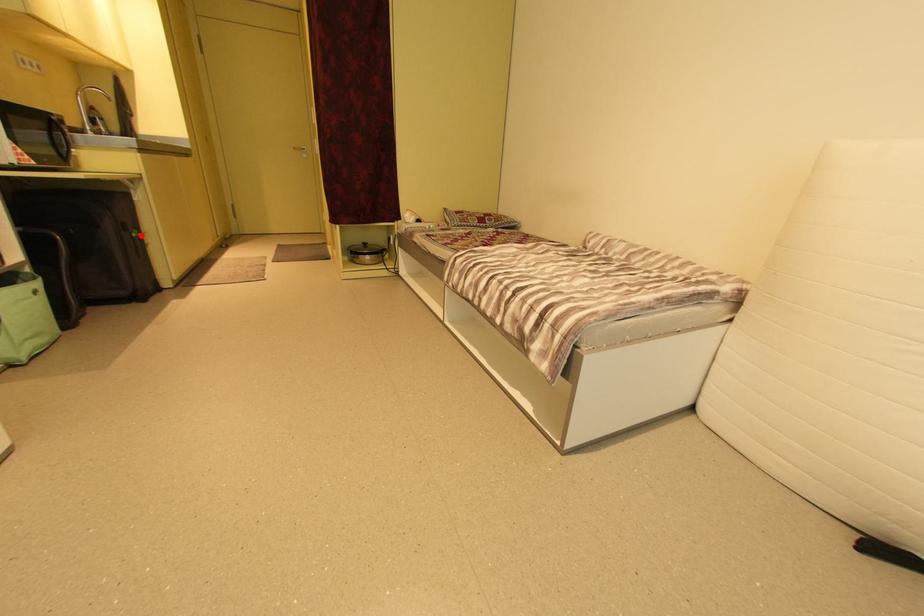
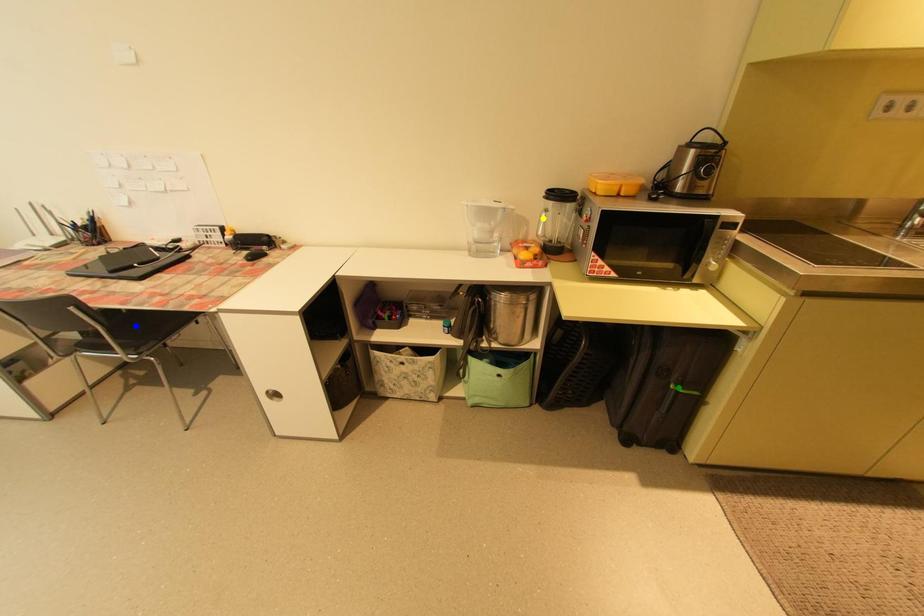
Question: I am providing you with two images of the same scene from different viewpoints. A red point is marked on the first image. You are given multiple points on the second image. In image 2, which mark is for the same physical point as the one in image 1?

Choices:
 (A) blue point
 (B) green point
 (C) yellow point

Answer: (B)